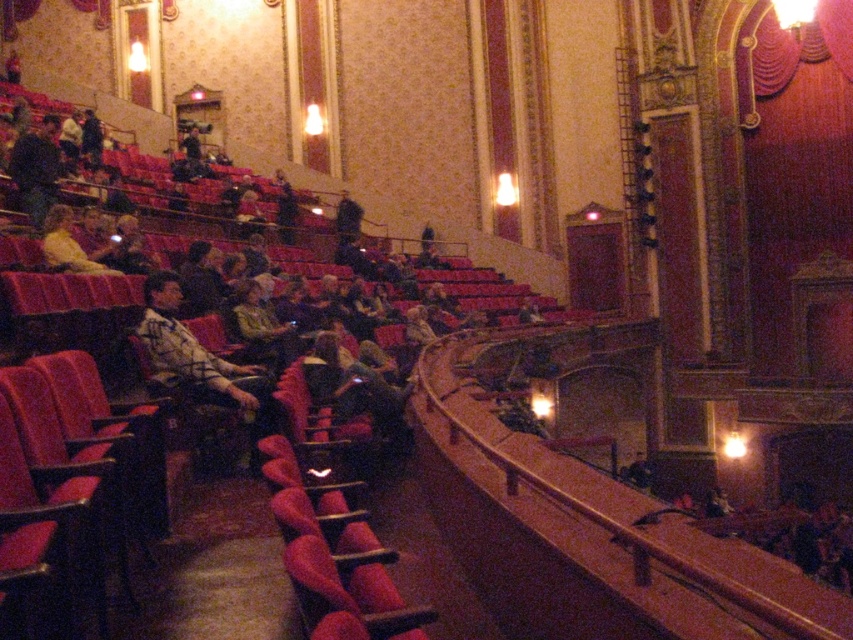
Can you confirm if plaid shirt at center is positioned to the left of leather jacket at center?

No, plaid shirt at center is not to the left of leather jacket at center.

In the scene shown: Between plaid shirt at center and leather jacket at center, which one is positioned lower?

Positioned lower is plaid shirt at center.

Locate an element on the screen. plaid shirt at center is located at coordinates (196, 358).